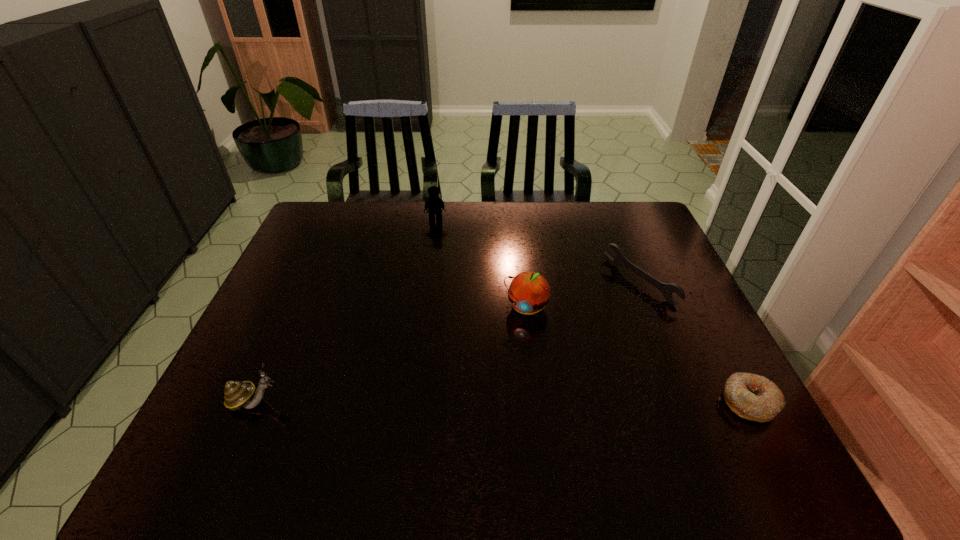
This screenshot has width=960, height=540. What are the coordinates of `free space on the desktop that is between the leftmost object and the doughnut and is positioned on the surface of the apple` in the screenshot? It's located at (490, 402).

I want to click on vacant space on the desktop that is between the snail and the doughnut and is positioned on the front-facing side of the farthest object, so click(x=441, y=402).

This screenshot has width=960, height=540. I want to click on free space on the desktop that is between the snail and the doughnut and is positioned on the open ends of the wrench, so click(x=432, y=402).